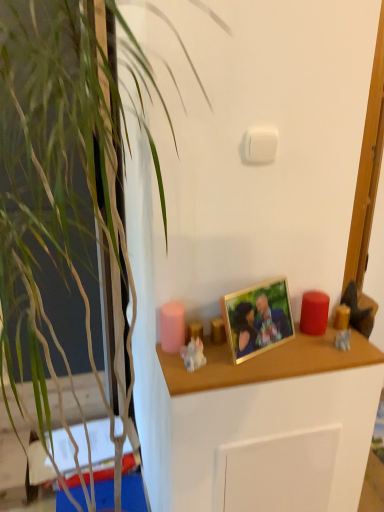
The height and width of the screenshot is (512, 384). What do you see at coordinates (172, 327) in the screenshot? I see `pink matte candle at center, positioned as the 1th candle in left-to-right order` at bounding box center [172, 327].

At what (x,y) coordinates should I click in order to perform the action: click on translucent amber glass candle at right, positioned as the first candle in right-to-left order. Please return your answer as a coordinate pair (x, y). The height and width of the screenshot is (512, 384). Looking at the image, I should click on (341, 317).

What do you see at coordinates (341, 317) in the screenshot?
I see `translucent amber glass candle at right, positioned as the first candle in right-to-left order` at bounding box center [341, 317].

The image size is (384, 512). Describe the element at coordinates (193, 354) in the screenshot. I see `porcelain figurine at center, positioned as the first toy in front-to-back order` at that location.

Identify the location of wooden shelf at center. This screenshot has width=384, height=512. (267, 362).

In order to click on white plastic light switch at upper center in this screenshot , I will do pyautogui.click(x=260, y=144).

Which of these two, translucent plastic figurine at right, placed as the 1th toy when sorted from back to front, or gold metallic picture frame at center, is thinner?

Thinner between the two is translucent plastic figurine at right, placed as the 1th toy when sorted from back to front.

From the picture: From a real-world perspective, is translucent plastic figurine at right, the first toy in the right-to-left sequence, under gold metallic picture frame at center?

Correct, in the physical world, translucent plastic figurine at right, the first toy in the right-to-left sequence, is lower than gold metallic picture frame at center.

Is translucent plastic figurine at right, the second toy in the front-to-back sequence, not near gold metallic picture frame at center?

That's not correct — translucent plastic figurine at right, the second toy in the front-to-back sequence, is a little close to gold metallic picture frame at center.

Considering the positions of point (340, 345) and point (278, 325), is point (340, 345) closer or farther from the camera than point (278, 325)?

Point (340, 345) is closer to the camera than point (278, 325).

Does point (161, 323) appear closer or farther from the camera than point (247, 378)?

Point (161, 323) appears to be farther away from the viewer than point (247, 378).

From the image's perspective, which one is positioned lower, pink matte candle at center, positioned as the 1th candle in left-to-right order, or wooden shelf at center?

wooden shelf at center, from the image's perspective.

From a real-world perspective, does pink matte candle at center, positioned as the 1th candle in left-to-right order, sit lower than wooden shelf at center?

Actually, pink matte candle at center, positioned as the 1th candle in left-to-right order, is physically above wooden shelf at center in the real world.

Are pink matte candle at center, positioned as the 1th candle in left-to-right order, and wooden shelf at center making contact?

No, pink matte candle at center, positioned as the 1th candle in left-to-right order, is not making contact with wooden shelf at center.

From a real-world perspective, between porcelain figurine at center, positioned as the first toy in front-to-back order, and red matte candle at right, the second candle viewed from the left, who is vertically lower?

From a 3D spatial view, porcelain figurine at center, positioned as the first toy in front-to-back order, is below.

Considering the points (189, 353) and (304, 316), which point is in front, point (189, 353) or point (304, 316)?

The point (189, 353) is closer.

Does porcelain figurine at center, the 1th toy viewed from the left, have a larger size compared to red matte candle at right, the second candle viewed from the left?

No, porcelain figurine at center, the 1th toy viewed from the left, is not bigger than red matte candle at right, the second candle viewed from the left.

Considering the relative sizes of porcelain figurine at center, the 1th toy viewed from the left, and red matte candle at right, the 2th candle positioned from the right, in the image provided, is porcelain figurine at center, the 1th toy viewed from the left, taller than red matte candle at right, the 2th candle positioned from the right,?

No, porcelain figurine at center, the 1th toy viewed from the left, is not taller than red matte candle at right, the 2th candle positioned from the right.

Which is more to the left, wooden cabinet at center or gold metallic picture frame at center?

Positioned to the left is gold metallic picture frame at center.

Is wooden cabinet at center surrounding gold metallic picture frame at center?

That's incorrect, gold metallic picture frame at center is not inside wooden cabinet at center.

Looking at this image, from a real-world perspective, between wooden cabinet at center and gold metallic picture frame at center, who is vertically lower?

wooden cabinet at center is physically lower.

Could you tell me if wooden cabinet at center is turned towards gold metallic picture frame at center?

No, wooden cabinet at center is not oriented towards gold metallic picture frame at center.

Locate an element on the screen. This screenshot has height=512, width=384. toy in front of the pink matte candle at center, acting as the 3th candle starting from the right is located at coordinates click(x=193, y=354).

Does point (165, 332) appear closer or farther from the camera than point (194, 345)?

Point (165, 332) appears to be farther away from the viewer than point (194, 345).

Between pink matte candle at center, acting as the 3th candle starting from the right, and porcelain figurine at center, positioned as the first toy in front-to-back order, which one has larger size?

Bigger between the two is pink matte candle at center, acting as the 3th candle starting from the right.

Between pink matte candle at center, acting as the 3th candle starting from the right, and porcelain figurine at center, which is the second toy from right to left, which one has smaller width?

porcelain figurine at center, which is the second toy from right to left.

How many degrees apart are the facing directions of wooden cabinet at center and white plastic light switch at upper center?

0.000632 degrees.

From the image's perspective, between wooden cabinet at center and white plastic light switch at upper center, which one is located above?

From the image's view, white plastic light switch at upper center is above.

Between point (161, 417) and point (267, 144), which one is positioned in front?

Positioned in front is point (267, 144).

Identify the location of light switch on the left of wooden cabinet at center. This screenshot has width=384, height=512. (260, 144).

Considering the sizes of objects red matte candle at right, the second candle viewed from the left, and wooden shelf at center in the image provided, who is bigger, red matte candle at right, the second candle viewed from the left, or wooden shelf at center?

wooden shelf at center.

Is there a large distance between red matte candle at right, the 2th candle positioned from the right, and wooden shelf at center?

That's not correct — red matte candle at right, the 2th candle positioned from the right, is a little close to wooden shelf at center.

Does point (319, 315) appear closer or farther from the camera than point (287, 371)?

Point (319, 315) appears to be farther away from the viewer than point (287, 371).

From a real-world perspective, relative to wooden shelf at center, is red matte candle at right, the second candle viewed from the left, vertically above or below?

red matte candle at right, the second candle viewed from the left, is situated higher than wooden shelf at center in the real world.

Where is `toy on the right of gold metallic picture frame at center`? The height and width of the screenshot is (512, 384). toy on the right of gold metallic picture frame at center is located at coordinates (343, 339).

Find the location of `desk lying in front of the pink matte candle at center, positioned as the 1th candle in left-to-right order`. desk lying in front of the pink matte candle at center, positioned as the 1th candle in left-to-right order is located at coordinates (267, 362).

Based on their spatial positions, is red matte candle at right, the 2th candle positioned from the right, or white plastic light switch at upper center further from translucent plastic figurine at right, placed as the 1th toy when sorted from back to front?

white plastic light switch at upper center is positioned further to the anchor translucent plastic figurine at right, placed as the 1th toy when sorted from back to front.

Considering their positions, is wooden cabinet at center positioned further to porcelain figurine at center, which is the second toy from right to left, than translucent plastic figurine at right, the first toy in the right-to-left sequence?

Among the two, translucent plastic figurine at right, the first toy in the right-to-left sequence, is located further to porcelain figurine at center, which is the second toy from right to left.

Estimate the real-world distances between objects in this image. Which object is further from porcelain figurine at center, positioned as the first toy in front-to-back order, translucent plastic figurine at right, the second toy in the front-to-back sequence, or white plastic light switch at upper center?

Based on the image, white plastic light switch at upper center appears to be further to porcelain figurine at center, positioned as the first toy in front-to-back order.

From the image, which object appears to be farther from red matte candle at right, the second candle viewed from the left, pink matte candle at center, acting as the 3th candle starting from the right, or porcelain figurine at center, positioned as the first toy in front-to-back order?

pink matte candle at center, acting as the 3th candle starting from the right, lies further to red matte candle at right, the second candle viewed from the left, than the other object.

When comparing their distances from translucent amber glass candle at right, positioned as the first candle in right-to-left order, does wooden shelf at center or gold metallic picture frame at center seem further?

gold metallic picture frame at center.

In the scene shown: Estimate the real-world distances between objects in this image. Which object is further from white plastic light switch at upper center, translucent amber glass candle at right, positioned as the first candle in right-to-left order, or red matte candle at right, the 2th candle positioned from the right?

Based on the image, translucent amber glass candle at right, positioned as the first candle in right-to-left order, appears to be further to white plastic light switch at upper center.

From the picture: When comparing their distances from translucent amber glass candle at right, which is the third candle from left to right, does gold metallic picture frame at center or translucent plastic figurine at right, placed as the 1th toy when sorted from back to front, seem closer?

Among the two, translucent plastic figurine at right, placed as the 1th toy when sorted from back to front, is located nearer to translucent amber glass candle at right, which is the third candle from left to right.

Looking at this image, based on their spatial positions, is porcelain figurine at center, the second toy viewed from the back, or red matte candle at right, the second candle viewed from the left, further from translucent plastic figurine at right, placed as the 1th toy when sorted from back to front?

porcelain figurine at center, the second toy viewed from the back, lies further to translucent plastic figurine at right, placed as the 1th toy when sorted from back to front, than the other object.

You are a GUI agent. You are given a task and a screenshot of the screen. Output one action in this format:
    pyautogui.click(x=<x>, y=<y>)
    Task: Click on the desk between pink matte candle at center, acting as the 3th candle starting from the right, and red matte candle at right, the 2th candle positioned from the right, in the horizontal direction
    This screenshot has height=512, width=384.
    Given the screenshot: What is the action you would take?
    pyautogui.click(x=267, y=362)

Where is `desk between pink matte candle at center, positioned as the 1th candle in left-to-right order, and wooden cabinet at center from top to bottom`? desk between pink matte candle at center, positioned as the 1th candle in left-to-right order, and wooden cabinet at center from top to bottom is located at coordinates (267, 362).

Image resolution: width=384 pixels, height=512 pixels. I want to click on toy between pink matte candle at center, positioned as the 1th candle in left-to-right order, and wooden shelf at center, so click(193, 354).

The image size is (384, 512). Find the location of `desk between porcelain figurine at center, the 1th toy viewed from the left, and translucent amber glass candle at right, positioned as the first candle in right-to-left order, in the horizontal direction`. desk between porcelain figurine at center, the 1th toy viewed from the left, and translucent amber glass candle at right, positioned as the first candle in right-to-left order, in the horizontal direction is located at coordinates (267, 362).